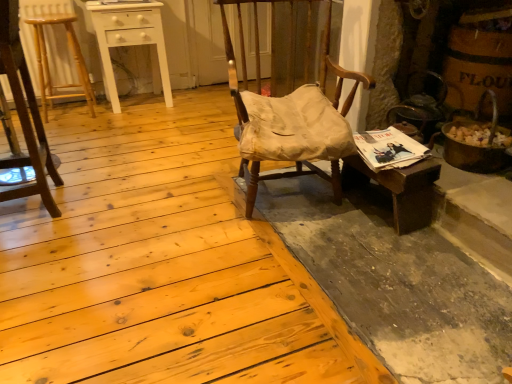
This screenshot has height=384, width=512. In order to click on vacant area in front of wooden stool at left, the first chair in the left-to-right sequence in this screenshot , I will do `click(36, 246)`.